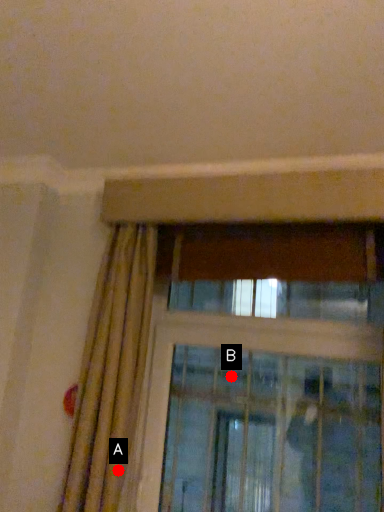
Question: Two points are circled on the image, labeled by A and B beside each circle. Which point is farther to the camera?

Choices:
 (A) A is further
 (B) B is further

Answer: (B)